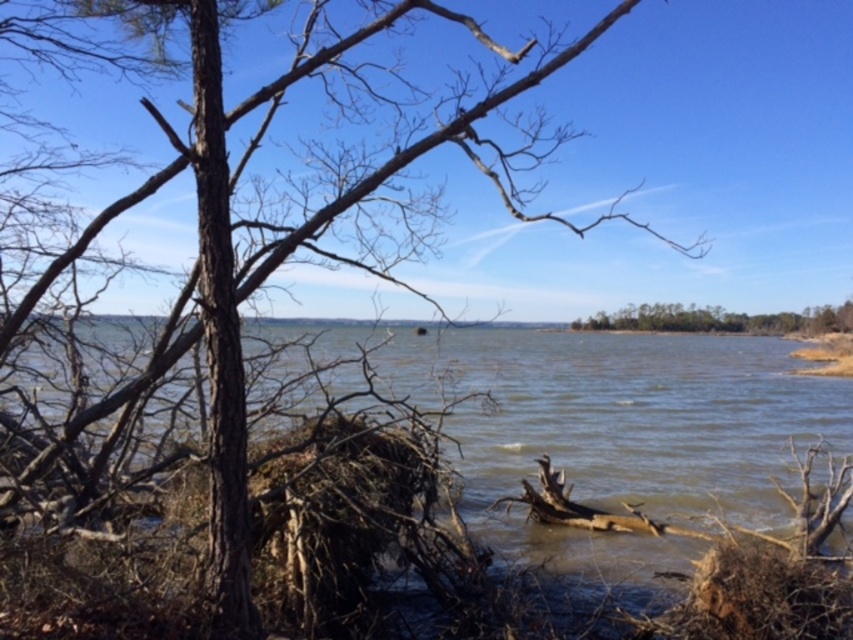
Based on the photo, between brown muddy water at center and green leafy tree at center, which one has more height?

brown muddy water at center

Is point (511, 337) closer to camera compared to point (651, 320)?

Yes, point (511, 337) is closer to viewer.

The image size is (853, 640). I want to click on brown muddy water at center, so click(x=625, y=428).

Locate an element on the screen. brown muddy water at center is located at coordinates (625, 428).